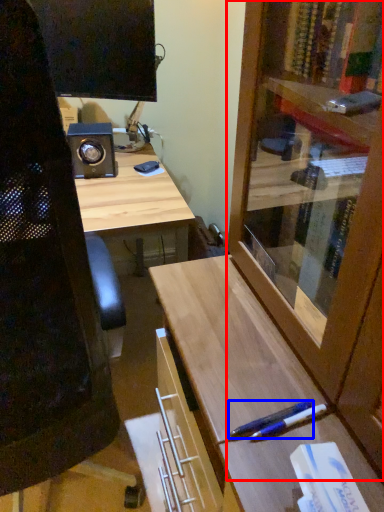
Question: Which of the following is the farthest to the observer, cabinetry (highlighted by a red box) or pen (highlighted by a blue box)?

Choices:
 (A) cabinetry
 (B) pen

Answer: (B)